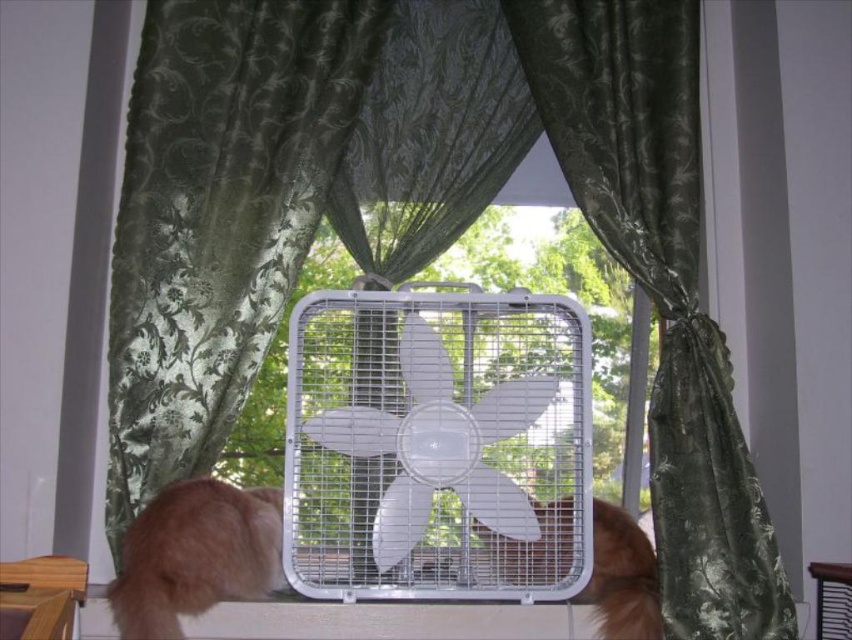
Question: Based on their relative distances, which object is farther from the fluffy orange fur at lower left?

Choices:
 (A) brown furry cat at center
 (B) green satin curtain at center
 (C) white plastic fan at center

Answer: (B)

Question: Does green satin curtain at center appear under fluffy orange fur at lower left?

Choices:
 (A) yes
 (B) no

Answer: (B)

Question: Does green satin curtain at center appear under brown furry cat at center?

Choices:
 (A) no
 (B) yes

Answer: (A)

Question: Which of these objects is positioned closest to the brown furry cat at center?

Choices:
 (A) white plastic fan at center
 (B) green satin curtain at center

Answer: (A)

Question: Which object appears closest to the camera in this image?

Choices:
 (A) green satin curtain at center
 (B) white plastic fan at center
 (C) fluffy orange fur at lower left

Answer: (C)

Question: Can you confirm if white plastic fan at center is wider than green satin curtain at center?

Choices:
 (A) yes
 (B) no

Answer: (A)